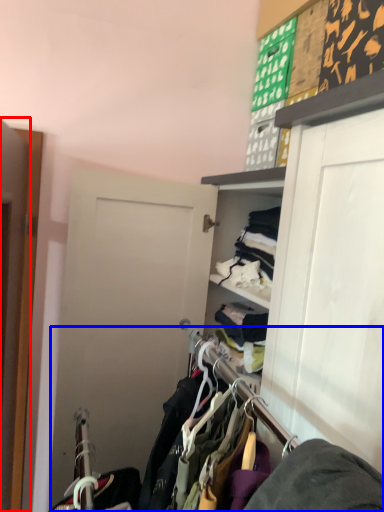
Question: Among these objects, which one is farthest to the camera, door (highlighted by a red box) or closet (highlighted by a blue box)?

Choices:
 (A) door
 (B) closet

Answer: (A)